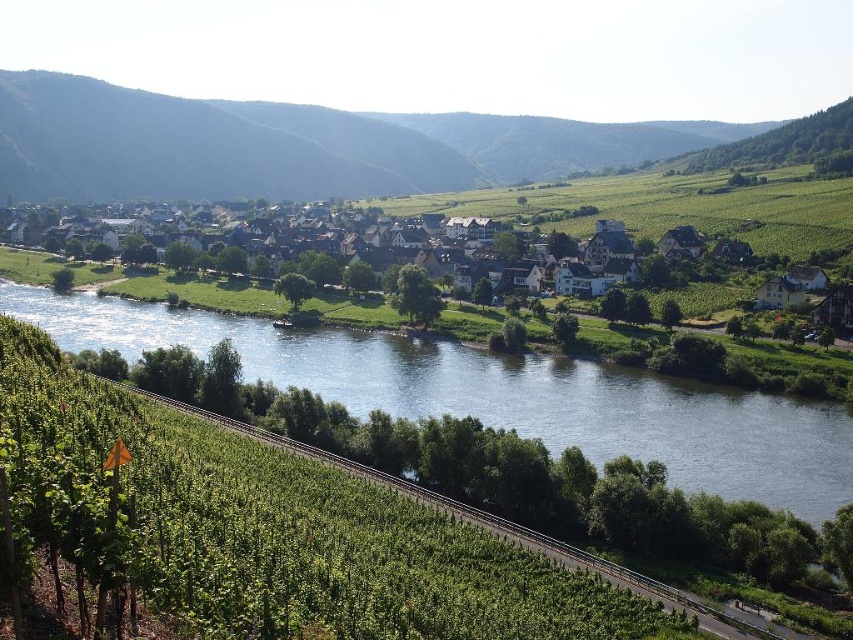
You are a landscape architect designing a new park. You have to decide where to place a large statue. The statue requires a base that is 2 meters tall. Based on the scene, which location between the green grassy river at center and the green grassy train track at lower left would allow the statue to be visible from a higher elevation? Explain your choice.

The green grassy river at center has a greater height compared to the green grassy train track at lower left. Therefore, placing the statue on the green grassy river at center would provide a higher elevation, making it visible from a distance.

You are standing at the camera position and want to cross the river. The shortest path to the green grassy river at center is 77.07 meters. If you have a 80 meter rope, can you safely reach the other side?

The green grassy river at center is 77.07 meters away from camera. Since the rope is 80 meters long, which is longer than the distance, you can safely reach the other side.

You are a tourist visiting the village and want to take a photo of the white wooden houses at center and the green grassy river at center. From where should you stand to capture both in one shot?

You should stand above the white wooden houses at center because the green grassy river at center is located below them, allowing both to be captured in the same frame when positioned higher up.